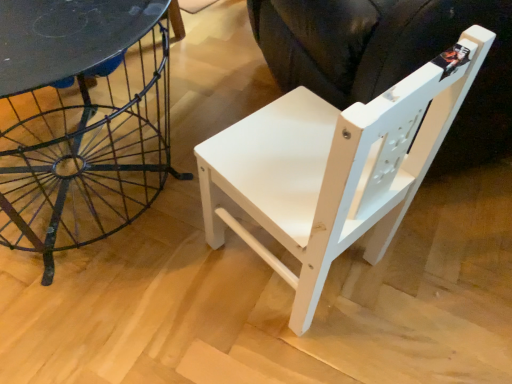
Question: Is matte black table at left oriented towards white matte wood swivel chair at center?

Choices:
 (A) no
 (B) yes

Answer: (A)

Question: Does matte black table at left appear on the right side of white matte wood swivel chair at center?

Choices:
 (A) yes
 (B) no

Answer: (B)

Question: From the image's perspective, is matte black table at left above white matte wood swivel chair at center?

Choices:
 (A) yes
 (B) no

Answer: (A)

Question: From the image's perspective, is matte black table at left below white matte wood swivel chair at center?

Choices:
 (A) no
 (B) yes

Answer: (A)

Question: Is matte black table at left taller than white matte wood swivel chair at center?

Choices:
 (A) yes
 (B) no

Answer: (B)

Question: Is point (10, 6) positioned closer to the camera than point (318, 248)?

Choices:
 (A) closer
 (B) farther

Answer: (B)

Question: Considering the positions of matte black table at left and white matte wood chair at center in the image, is matte black table at left bigger or smaller than white matte wood chair at center?

Choices:
 (A) small
 (B) big

Answer: (A)

Question: From the image's perspective, is matte black table at left positioned above or below white matte wood chair at center?

Choices:
 (A) below
 (B) above

Answer: (B)

Question: In terms of width, does matte black table at left look wider or thinner when compared to white matte wood chair at center?

Choices:
 (A) wide
 (B) thin

Answer: (B)

Question: Is white matte wood chair at center bigger or smaller than white matte wood swivel chair at center?

Choices:
 (A) small
 (B) big

Answer: (A)

Question: Is white matte wood chair at center inside or outside of white matte wood swivel chair at center?

Choices:
 (A) inside
 (B) outside

Answer: (B)

Question: Is white matte wood chair at center in front of or behind white matte wood swivel chair at center in the image?

Choices:
 (A) behind
 (B) front

Answer: (B)

Question: Is white matte wood chair at center wider or thinner than white matte wood swivel chair at center?

Choices:
 (A) thin
 (B) wide

Answer: (A)

Question: Is white matte wood chair at center inside or outside of matte black table at left?

Choices:
 (A) outside
 (B) inside

Answer: (A)

Question: From the image's perspective, is white matte wood chair at center located above or below matte black table at left?

Choices:
 (A) above
 (B) below

Answer: (B)